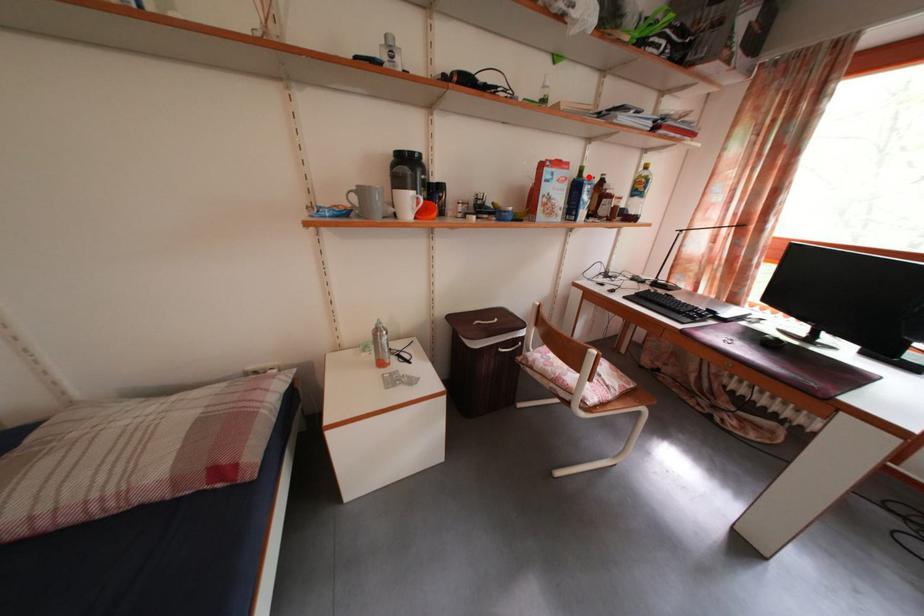
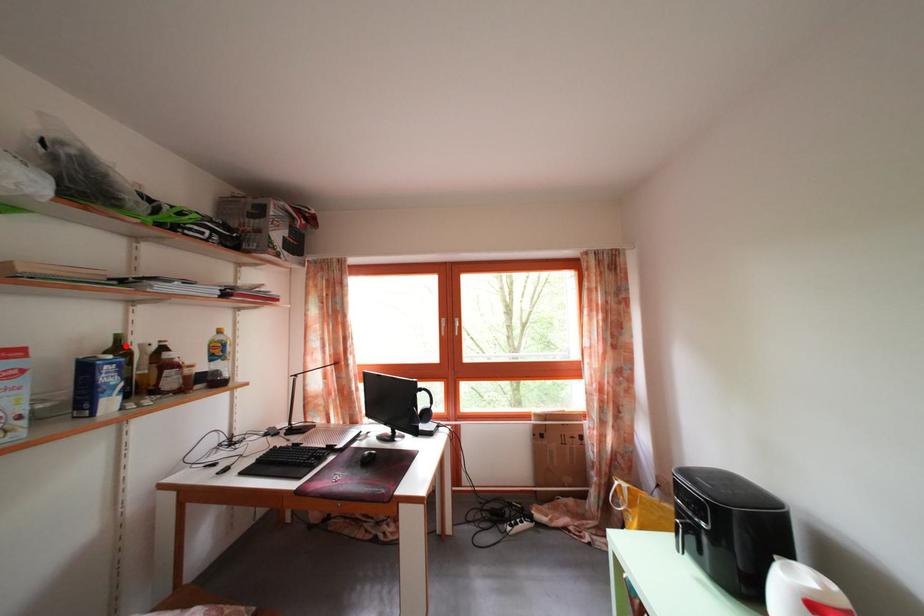
I am providing you with two images of the same scene from different viewpoints. A red point is marked on the first image and another point is marked on the second image. Are the points marked in image1 and image2 representing the same 3D position?

Yes